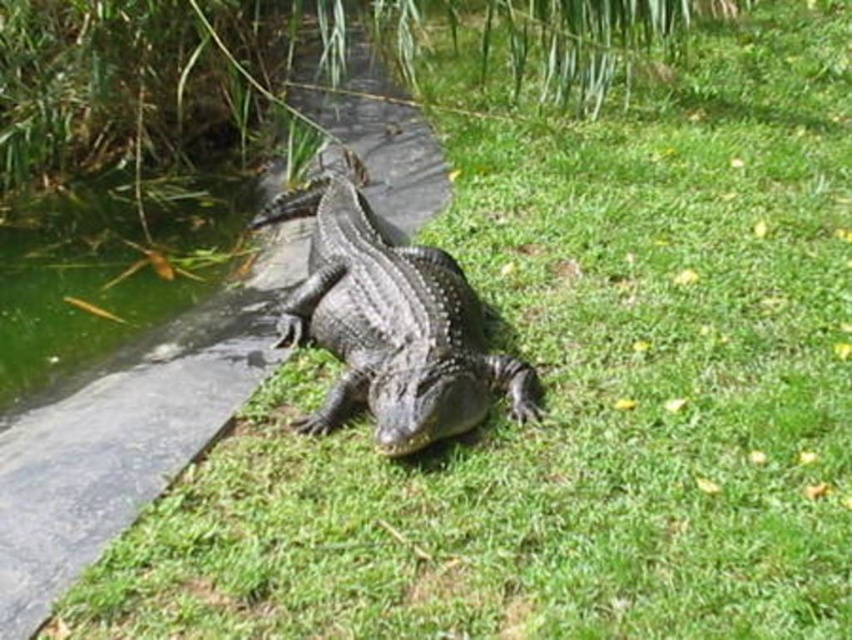
You are standing at the center of the image. There is a shiny dark green crocodile at center. Where would you need to move to see the crocodile fully in your field of view?

Since the shiny dark green crocodile at center is located exactly at the center of the image at point coordinates (389, 320), you don not need to move at all. You are already positioned to see the crocodile fully within your field of view.

You are a wildlife photographer aiming to capture a closeup shot of the shiny dark green crocodile at center without disturbing the water. You have a camera with a 30 inch long extension pole. Can you reach the crocodile at center from your current position near the green algae water at lower left without entering the water?

The distance between the shiny dark green crocodile at center and the green algae water at lower left is 38.85 inches. Since your extension pole is only 30 inches long, you cannot reach the crocodile without moving closer or entering the water.